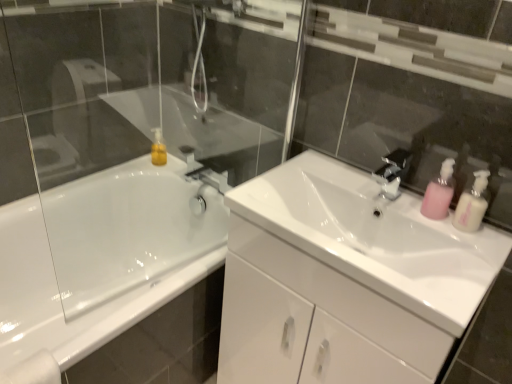
What do you see at coordinates (439, 192) in the screenshot? I see `pink plastic soap dispenser at right, acting as the second soap dispenser starting from the right` at bounding box center [439, 192].

Image resolution: width=512 pixels, height=384 pixels. In order to click on white glossy sink at center in this screenshot , I will do `click(375, 238)`.

Between white glossy bathtub at left and pink plastic soap dispenser at right, the 1th soap dispenser when ordered from left to right, which one is positioned in front?

white glossy bathtub at left is in front.

Is white glossy bathtub at left bigger than pink plastic soap dispenser at right, the 1th soap dispenser when ordered from left to right?

Yes.

In terms of height, does white glossy bathtub at left look taller or shorter compared to pink plastic soap dispenser at right, the 1th soap dispenser when ordered from left to right?

In the image, white glossy bathtub at left appears to be taller than pink plastic soap dispenser at right, the 1th soap dispenser when ordered from left to right.

Where is `bath lying below the pink plastic soap dispenser at right, the 1th soap dispenser when ordered from left to right (from the image's perspective)`? bath lying below the pink plastic soap dispenser at right, the 1th soap dispenser when ordered from left to right (from the image's perspective) is located at coordinates (102, 257).

Which object is positioned more to the left, white glossy sink at center or white glossy bathtub at left?

From the viewer's perspective, white glossy bathtub at left appears more on the left side.

Locate an element on the screen. The image size is (512, 384). sink that is above the white glossy bathtub at left (from a real-world perspective) is located at coordinates (375, 238).

Is white glossy sink at center thinner than white glossy bathtub at left?

Correct, the width of white glossy sink at center is less than that of white glossy bathtub at left.

Consider the image. Would you say white glossy sink at center is a long distance from white glossy bathtub at left?

Actually, white glossy sink at center and white glossy bathtub at left are a little close together.

Where is `sink that appears below the black metallic faucet at upper center (from a real-world perspective)`? sink that appears below the black metallic faucet at upper center (from a real-world perspective) is located at coordinates (375, 238).

Can you tell me how much black metallic faucet at upper center and white glossy sink at center differ in facing direction?

The facing directions of black metallic faucet at upper center and white glossy sink at center are 0.00306 degrees apart.

Is black metallic faucet at upper center in contact with white glossy sink at center?

They are not placed beside each other.

From the image's perspective, is black metallic faucet at upper center under white glossy sink at center?

No, from the image's perspective, black metallic faucet at upper center is not below white glossy sink at center.

Looking at this image, how much distance is there between pink plastic soap dispenser at right, the 1th soap dispenser when ordered from left to right, and white glossy bathtub at left?

They are 1.12 meters apart.

Is pink plastic soap dispenser at right, acting as the second soap dispenser starting from the right, situated inside white glossy bathtub at left or outside?

pink plastic soap dispenser at right, acting as the second soap dispenser starting from the right, is not inside white glossy bathtub at left, it's outside.

Is pink plastic soap dispenser at right, acting as the second soap dispenser starting from the right, far away from white glossy bathtub at left?

pink plastic soap dispenser at right, acting as the second soap dispenser starting from the right, is positioned a significant distance from white glossy bathtub at left.

Visually, is pink plastic soap dispenser at right, acting as the second soap dispenser starting from the right, positioned to the left or to the right of white glossy bathtub at left?

pink plastic soap dispenser at right, acting as the second soap dispenser starting from the right, is to the right of white glossy bathtub at left.

Can you confirm if pink plastic soap dispenser at right, the second soap dispenser in the left-to-right sequence, is taller than pink plastic soap dispenser at right, the 1th soap dispenser when ordered from left to right?

No.

Considering the points (485, 204) and (435, 203), which point is behind, point (485, 204) or point (435, 203)?

The point (435, 203) is more distant.

The width and height of the screenshot is (512, 384). What are the coordinates of `soap dispenser that is above the pink plastic soap dispenser at right, the first soap dispenser viewed from the right (from the image's perspective)` in the screenshot? It's located at (439, 192).

Is pink plastic soap dispenser at right, the second soap dispenser in the left-to-right sequence, far from pink plastic soap dispenser at right, acting as the second soap dispenser starting from the right?

No, pink plastic soap dispenser at right, the second soap dispenser in the left-to-right sequence, is not far away from pink plastic soap dispenser at right, acting as the second soap dispenser starting from the right.

Is point (486, 202) closer to camera compared to point (397, 197)?

That is True.

Is pink plastic soap dispenser at right, the second soap dispenser in the left-to-right sequence, located outside black metallic faucet at upper center?

pink plastic soap dispenser at right, the second soap dispenser in the left-to-right sequence, lies outside black metallic faucet at upper center's area.

Does pink plastic soap dispenser at right, the first soap dispenser viewed from the right, have a lesser height compared to black metallic faucet at upper center?

No.

From the picture: Is pink plastic soap dispenser at right, the second soap dispenser in the left-to-right sequence, not near black metallic faucet at upper center?

No, pink plastic soap dispenser at right, the second soap dispenser in the left-to-right sequence, is not far from black metallic faucet at upper center.

Does point (401, 169) come behind point (429, 194)?

Yes, point (401, 169) is farther from viewer.

Looking at the image, does black metallic faucet at upper center seem bigger or smaller compared to pink plastic soap dispenser at right, the 1th soap dispenser when ordered from left to right?

Considering their sizes, black metallic faucet at upper center takes up more space than pink plastic soap dispenser at right, the 1th soap dispenser when ordered from left to right.

Could you tell me if black metallic faucet at upper center is facing pink plastic soap dispenser at right, the 1th soap dispenser when ordered from left to right?

No.

I want to click on the 2nd soap dispenser above the white glossy bathtub at left (from the image's perspective), so click(x=439, y=192).

I want to click on sink to the right of white glossy bathtub at left, so click(375, 238).

When comparing their distances from white glossy bathtub at left, does black metallic faucet at upper center or pink plastic soap dispenser at right, the 1th soap dispenser when ordered from left to right, seem further?

The object further to white glossy bathtub at left is pink plastic soap dispenser at right, the 1th soap dispenser when ordered from left to right.

From the image, which object appears to be nearer to white glossy sink at center, pink plastic soap dispenser at right, the second soap dispenser in the left-to-right sequence, or black metallic faucet at upper center?

black metallic faucet at upper center is positioned closer to the anchor white glossy sink at center.

Based on their spatial positions, is white glossy bathtub at left or pink plastic soap dispenser at right, the second soap dispenser in the left-to-right sequence, further from white glossy sink at center?

white glossy bathtub at left is positioned further to the anchor white glossy sink at center.

Looking at this image, looking at the image, which one is located closer to pink plastic soap dispenser at right, the second soap dispenser in the left-to-right sequence, pink plastic soap dispenser at right, acting as the second soap dispenser starting from the right, or black metallic faucet at upper center?

Among the two, pink plastic soap dispenser at right, acting as the second soap dispenser starting from the right, is located nearer to pink plastic soap dispenser at right, the second soap dispenser in the left-to-right sequence.

Based on their spatial positions, is white glossy bathtub at left or pink plastic soap dispenser at right, the 1th soap dispenser when ordered from left to right, closer to pink plastic soap dispenser at right, the second soap dispenser in the left-to-right sequence?

The object closer to pink plastic soap dispenser at right, the second soap dispenser in the left-to-right sequence, is pink plastic soap dispenser at right, the 1th soap dispenser when ordered from left to right.

Considering their positions, is black metallic faucet at upper center positioned closer to white glossy sink at center than pink plastic soap dispenser at right, the first soap dispenser viewed from the right?

black metallic faucet at upper center is positioned closer to the anchor white glossy sink at center.

From the image, which object appears to be farther from pink plastic soap dispenser at right, the 1th soap dispenser when ordered from left to right, pink plastic soap dispenser at right, the second soap dispenser in the left-to-right sequence, or white glossy bathtub at left?

white glossy bathtub at left is further to pink plastic soap dispenser at right, the 1th soap dispenser when ordered from left to right.

Considering their positions, is white glossy sink at center positioned further to white glossy bathtub at left than pink plastic soap dispenser at right, the 1th soap dispenser when ordered from left to right?

pink plastic soap dispenser at right, the 1th soap dispenser when ordered from left to right.

Locate an element on the screen. The width and height of the screenshot is (512, 384). sink situated between white glossy bathtub at left and pink plastic soap dispenser at right, acting as the second soap dispenser starting from the right, from left to right is located at coordinates (375, 238).

Find the location of `tap located between white glossy bathtub at left and pink plastic soap dispenser at right, acting as the second soap dispenser starting from the right, in the left-right direction`. tap located between white glossy bathtub at left and pink plastic soap dispenser at right, acting as the second soap dispenser starting from the right, in the left-right direction is located at coordinates (392, 173).

Identify the location of sink between white glossy bathtub at left and black metallic faucet at upper center in the horizontal direction. The height and width of the screenshot is (384, 512). (375, 238).

This screenshot has width=512, height=384. What are the coordinates of `sink situated between white glossy bathtub at left and pink plastic soap dispenser at right, the first soap dispenser viewed from the right, from left to right` in the screenshot? It's located at (375, 238).